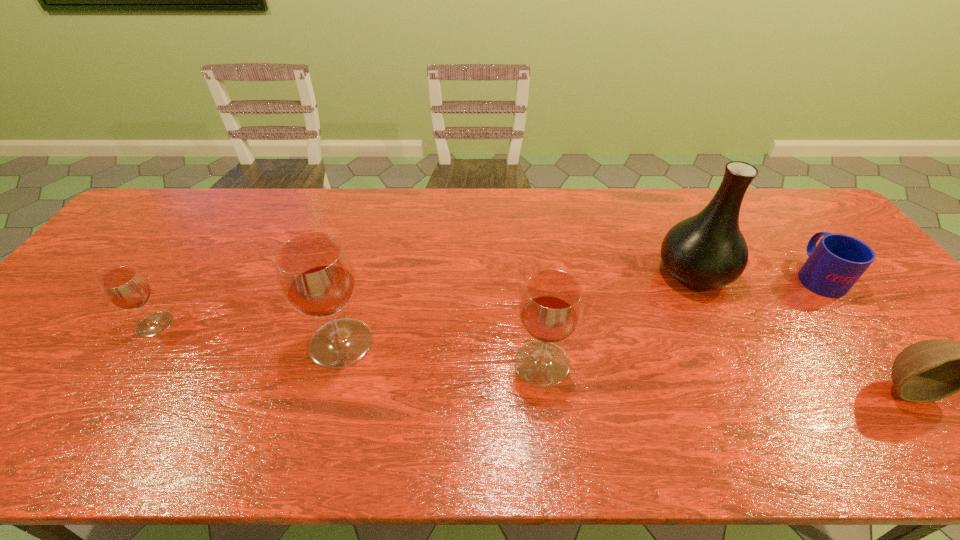
I want to click on object that stands as the second closest to the second shortest wineglass, so [315, 274].

This screenshot has width=960, height=540. I want to click on the second closest object relative to the bowl, so click(707, 251).

Identify the location of wineglass that is the second closest to the third tallest object. (125, 287).

Find the location of a particular element. wineglass identified as the second closest to the vase is located at coordinates (315, 274).

Find the location of a particular element. free spot that satisfies the following two spatial constraints: 1. on the front side of the fifth object from right to left; 2. on the left side of the leftmost object is located at coordinates (143, 343).